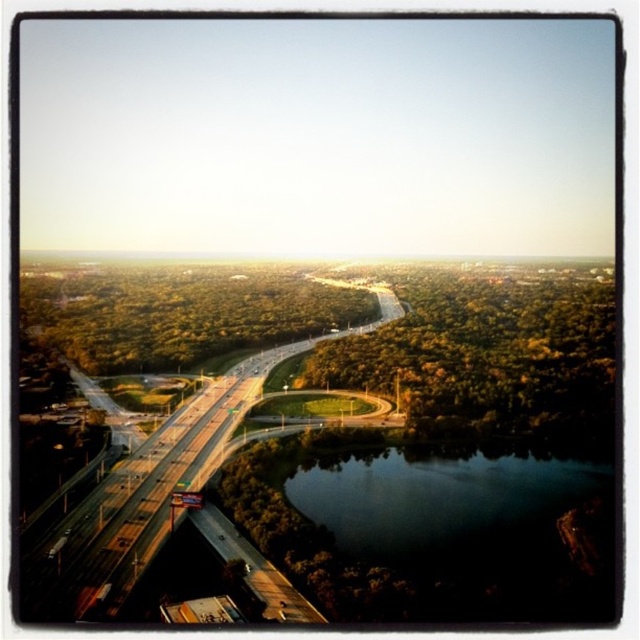
You are a drone operator planning to fly a drone over the dark reflective water at lower center and the green asphalt highway at center. Considering their widths, which path would you choose to ensure the drone stays within the narrower area?

The dark reflective water at lower center is thinner than the green asphalt highway at center, so the drone should fly over the dark reflective water at lower center to stay within the narrower area.

You are a drone operator trying to capture a photo of the green asphalt highway at center from above. However, you notice the dark reflective water at lower center might interfere with your shot. Based on their positions, will the water block your view of the highway?

The dark reflective water at lower center is located below the green asphalt highway at center, so it will not block the view of the highway from above.

Consider the image. You are a drone operator tasked with capturing aerial footage of the highway. You have two points marked on your map for the drone to fly between. The first point is at coordinate point (378, 538). The second point is at coordinate point 0.673, 0.421. The drone has a maximum flight distance of 700 feet. Will the drone be able to fly between these two points without needing to recharge?

The distance between point (378, 538) and point 0.673, 0.421 is 708.96 feet. Since the drone has a maximum flight distance of 700 feet, it will not be able to fly between these two points without needing to recharge.